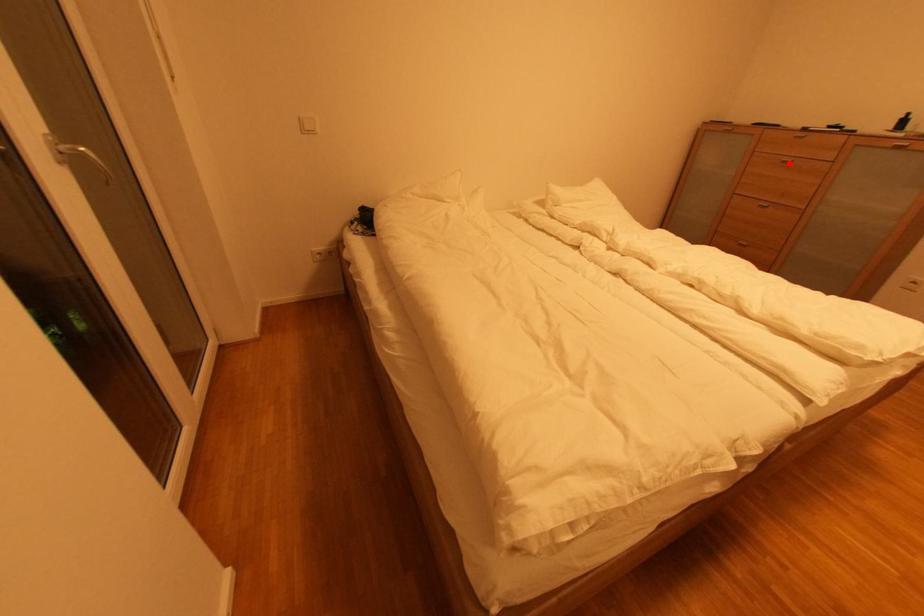
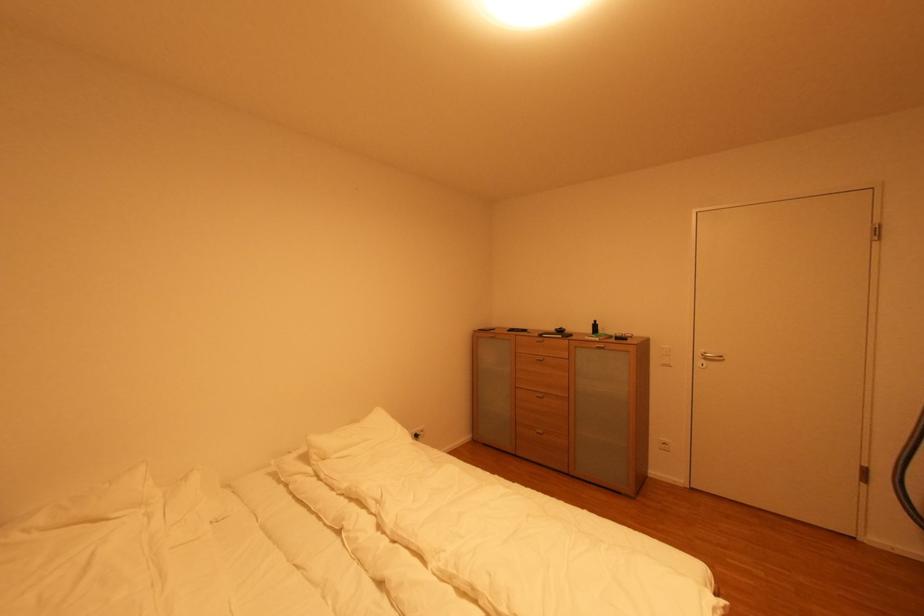
Question: I am providing you with two images of the same scene from different viewpoints. In image1, a red point is highlighted. Considering the same 3D point in image2, which of the following is correct?

Choices:
 (A) It is closer
 (B) It is farther

Answer: (A)